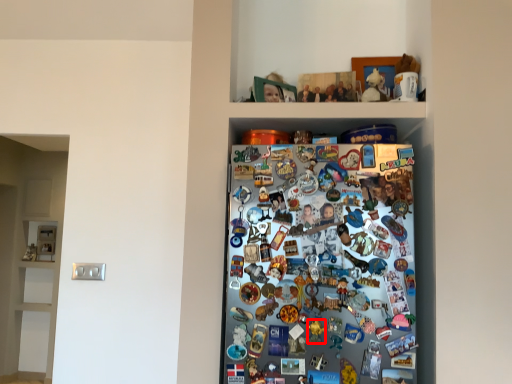
Question: From the image's perspective, where is toy (annotated by the red box) located relative to toy?

Choices:
 (A) below
 (B) above

Answer: (A)